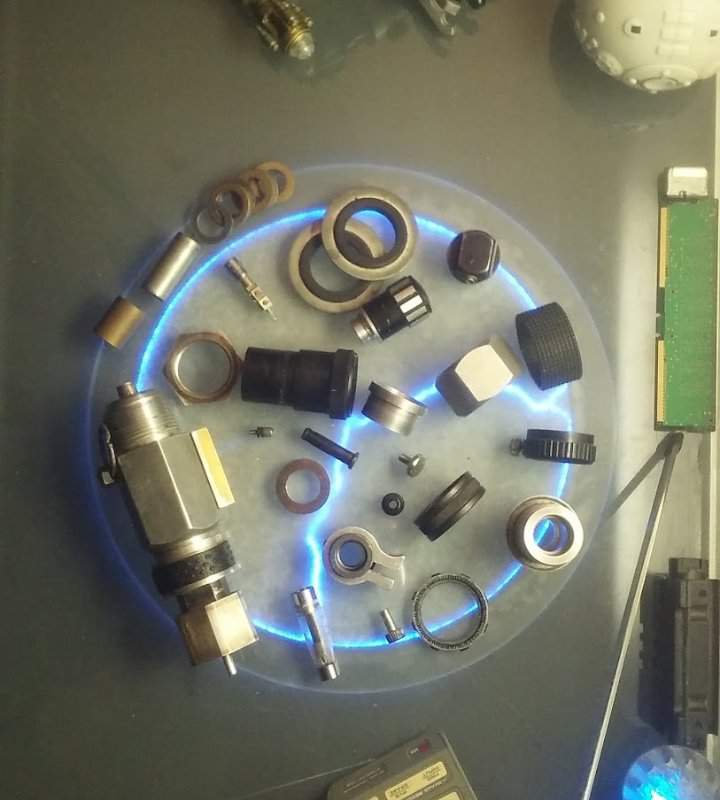
Where is `reflection on table`? The width and height of the screenshot is (720, 800). reflection on table is located at coordinates (348, 26).